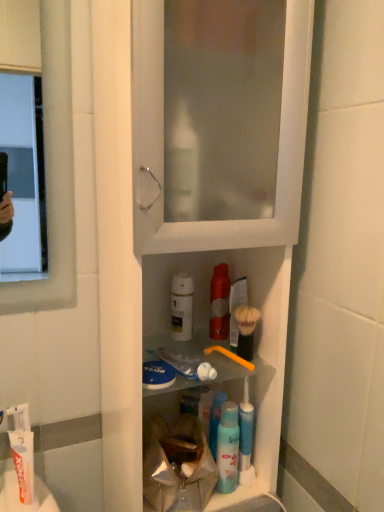
Where is `white matte toothpaste at lower left, the first toothpaste when ordered from left to right`? The width and height of the screenshot is (384, 512). white matte toothpaste at lower left, the first toothpaste when ordered from left to right is located at coordinates (23, 451).

Image resolution: width=384 pixels, height=512 pixels. Describe the element at coordinates (194, 220) in the screenshot. I see `white plastic cabinet at center` at that location.

Measure the distance between point (185, 382) and camera.

The depth of point (185, 382) is 34.33 inches.

This screenshot has height=512, width=384. What do you see at coordinates (181, 306) in the screenshot?
I see `white glossy lotion at center` at bounding box center [181, 306].

Locate an element on the screen. This screenshot has height=512, width=384. white matte toothpaste at lower left, the 2th toothpaste from the right is located at coordinates (23, 451).

Between white plastic cabinet at center and white matte toothpaste at lower left, the first toothpaste when ordered from left to right, which one has smaller size?

white matte toothpaste at lower left, the first toothpaste when ordered from left to right.

Does white plastic cabinet at center lie in front of white matte toothpaste at lower left, the 2th toothpaste from the right?

Yes, it is in front of white matte toothpaste at lower left, the 2th toothpaste from the right.

Consider the image. From a real-world perspective, who is located higher, white plastic cabinet at center or white matte toothpaste at lower left, the first toothpaste when ordered from left to right?

white plastic cabinet at center.

From the image's perspective, is white plastic cabinet at center located above or below white matte toothpaste at lower left, the first toothpaste when ordered from left to right?

Based on their image positions, white plastic cabinet at center is located above white matte toothpaste at lower left, the first toothpaste when ordered from left to right.

From a real-world perspective, which is physically below, yellow plastic toothbrush at center-right or yellow plastic toothpaste at center, the first toothpaste viewed from the right?

yellow plastic toothpaste at center, the first toothpaste viewed from the right.

From a real-world perspective, starting from the yellow plastic toothbrush at center-right, which toothpaste is the 1st one below it? Please provide its 2D coordinates.

[(186, 365)]

Relative to yellow plastic toothpaste at center, the first toothpaste viewed from the right, is yellow plastic toothbrush at center-right in front or behind?

In the image, yellow plastic toothbrush at center-right appears behind yellow plastic toothpaste at center, the first toothpaste viewed from the right.

Are yellow plastic toothbrush at center-right and yellow plastic toothpaste at center, which is the second toothpaste from bottom to top, far apart?

No, yellow plastic toothbrush at center-right is not far away from yellow plastic toothpaste at center, which is the second toothpaste from bottom to top.

Is yellow plastic toothpaste at center, the first toothpaste viewed from the right, oriented away from white matte toothpaste at lower left, the first toothpaste when ordered from left to right?

yellow plastic toothpaste at center, the first toothpaste viewed from the right, is not turned away from white matte toothpaste at lower left, the first toothpaste when ordered from left to right.

Is point (208, 364) less distant than point (31, 472)?

No, it is not.

In terms of height, does yellow plastic toothpaste at center, acting as the 2th toothpaste starting from the left, look taller or shorter compared to white matte toothpaste at lower left, the first toothpaste when ordered from left to right?

In the image, yellow plastic toothpaste at center, acting as the 2th toothpaste starting from the left, appears to be shorter than white matte toothpaste at lower left, the first toothpaste when ordered from left to right.

What's the angular difference between white glossy lotion at center and yellow plastic toothbrush at center-right's facing directions?

white glossy lotion at center and yellow plastic toothbrush at center-right are facing 6.38e-05 degrees away from each other.

Where is `brush in front of the white glossy lotion at center`? The height and width of the screenshot is (512, 384). brush in front of the white glossy lotion at center is located at coordinates 246,329.

Is white glossy lotion at center far away from yellow plastic toothbrush at center-right?

white glossy lotion at center is actually quite close to yellow plastic toothbrush at center-right.

Is white glossy lotion at center oriented away from yellow plastic toothbrush at center-right?

No, yellow plastic toothbrush at center-right is not at the back of white glossy lotion at center.

From a real-world perspective, between blue plastic mouthwash at center and white glossy lotion at center, who is vertically lower?

blue plastic mouthwash at center, from a real-world perspective.

Are blue plastic mouthwash at center and white glossy lotion at center far apart?

blue plastic mouthwash at center is actually quite close to white glossy lotion at center.

From the image's perspective, which one is positioned higher, blue plastic mouthwash at center or white glossy lotion at center?

From the image's view, white glossy lotion at center is above.

Can you confirm if blue plastic mouthwash at center is taller than white glossy lotion at center?

Yes, blue plastic mouthwash at center is taller than white glossy lotion at center.

Would you say yellow plastic toothbrush at center-right is a long distance from white matte toothpaste at lower left, the 2th toothpaste from the right?

yellow plastic toothbrush at center-right is near white matte toothpaste at lower left, the 2th toothpaste from the right, not far away.

Where is `toothpaste that is the 2nd one when counting leftward from the yellow plastic toothbrush at center-right`? This screenshot has width=384, height=512. toothpaste that is the 2nd one when counting leftward from the yellow plastic toothbrush at center-right is located at coordinates (23, 451).

Is white matte toothpaste at lower left, the 2th toothpaste from the right, a part of yellow plastic toothbrush at center-right?

No, yellow plastic toothbrush at center-right does not contain white matte toothpaste at lower left, the 2th toothpaste from the right.

Is yellow plastic toothpaste at center, which appears as the 1th toothpaste when viewed from the top, oriented away from white glossy lotion at center?

Yes.

From a real-world perspective, is yellow plastic toothpaste at center, acting as the 2th toothpaste starting from the left, beneath white glossy lotion at center?

Yes, from a real-world perspective, yellow plastic toothpaste at center, acting as the 2th toothpaste starting from the left, is beneath white glossy lotion at center.

Would you say yellow plastic toothpaste at center, which is the second toothpaste from bottom to top, is to the left or to the right of white glossy lotion at center in the picture?

Clearly, yellow plastic toothpaste at center, which is the second toothpaste from bottom to top, is on the right of white glossy lotion at center in the image.

Locate an element on the screen. The height and width of the screenshot is (512, 384). toothpaste on the left of white plastic cabinet at center is located at coordinates (23, 451).

Where is `toothpaste that is the 1st one when counting downward from the yellow plastic toothbrush at center-right (from the image's perspective)`? Image resolution: width=384 pixels, height=512 pixels. toothpaste that is the 1st one when counting downward from the yellow plastic toothbrush at center-right (from the image's perspective) is located at coordinates (186, 365).

Considering their positions, is white matte toothpaste at lower left, the first toothpaste from the bottom, positioned further to yellow plastic toothbrush at center-right than white glossy lotion at center?

white matte toothpaste at lower left, the first toothpaste from the bottom, lies further to yellow plastic toothbrush at center-right than the other object.

Considering their positions, is blue plastic mouthwash at center positioned further to yellow plastic toothpaste at center, which is the second toothpaste from bottom to top, than white matte toothpaste at lower left, the 2th toothpaste in the top-to-bottom sequence?

Among the two, white matte toothpaste at lower left, the 2th toothpaste in the top-to-bottom sequence, is located further to yellow plastic toothpaste at center, which is the second toothpaste from bottom to top.

Based on their spatial positions, is white glossy lotion at center or white matte toothpaste at lower left, the 2th toothpaste from the right, closer to blue plastic mouthwash at center?

The object closer to blue plastic mouthwash at center is white glossy lotion at center.

Considering their positions, is yellow plastic toothpaste at center, the first toothpaste viewed from the right, positioned further to yellow plastic toothbrush at center-right than white matte toothpaste at lower left, the first toothpaste when ordered from left to right?

white matte toothpaste at lower left, the first toothpaste when ordered from left to right, is further to yellow plastic toothbrush at center-right.

When comparing their distances from yellow plastic toothpaste at center, acting as the 2th toothpaste starting from the left, does yellow plastic toothbrush at center-right or white matte toothpaste at lower left, the first toothpaste when ordered from left to right, seem further?

The object further to yellow plastic toothpaste at center, acting as the 2th toothpaste starting from the left, is white matte toothpaste at lower left, the first toothpaste when ordered from left to right.

When comparing their distances from yellow plastic toothbrush at center-right, does blue plastic mouthwash at center or white matte toothpaste at lower left, the first toothpaste from the bottom, seem closer?

blue plastic mouthwash at center is positioned closer to the anchor yellow plastic toothbrush at center-right.

From the image, which object appears to be nearer to white glossy lotion at center, blue plastic mouthwash at center or yellow plastic toothbrush at center-right?

yellow plastic toothbrush at center-right is positioned closer to the anchor white glossy lotion at center.

Looking at this image, based on their spatial positions, is white matte toothpaste at lower left, the first toothpaste from the bottom, or white glossy lotion at center closer to white plastic cabinet at center?

The object closer to white plastic cabinet at center is white glossy lotion at center.

Image resolution: width=384 pixels, height=512 pixels. In order to click on cabinetry between white matte toothpaste at lower left, the first toothpaste from the bottom, and blue plastic mouthwash at center, in the horizontal direction in this screenshot , I will do `click(194, 220)`.

You are a GUI agent. You are given a task and a screenshot of the screen. Output one action in this format:
    pyautogui.click(x=<x>, y=<y>)
    Task: Click on the brush between yellow plastic toothpaste at center, acting as the 2th toothpaste starting from the left, and white glossy lotion at center from front to back
    The image size is (384, 512).
    Given the screenshot: What is the action you would take?
    pyautogui.click(x=246, y=329)

The image size is (384, 512). I want to click on toiletry located between white matte toothpaste at lower left, the 2th toothpaste from the right, and yellow plastic toothpaste at center, which appears as the 1th toothpaste when viewed from the top, in the left-right direction, so click(x=181, y=306).

Find the location of a particular element. cabinetry situated between white matte toothpaste at lower left, the first toothpaste from the bottom, and yellow plastic toothpaste at center, acting as the 2th toothpaste starting from the left, from left to right is located at coordinates (194, 220).